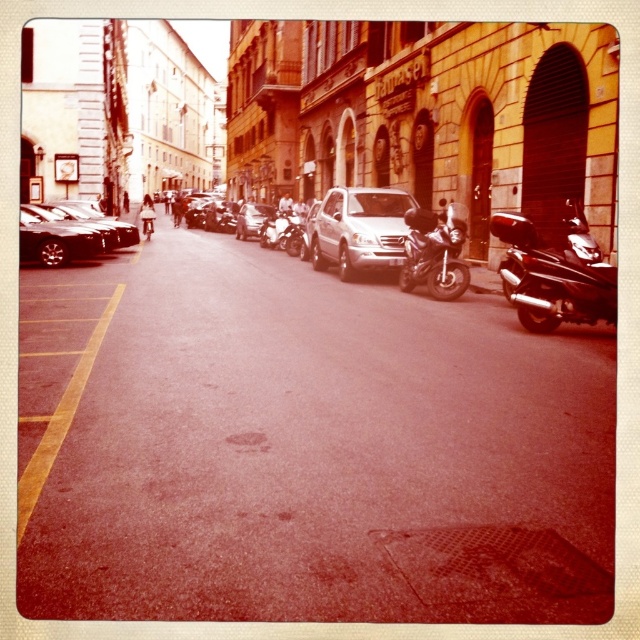
You are a delivery person trying to park your vehicle in this narrow street. You see the silver metallic van at center and the shiny chrome motorcycle at right. Which vehicle has more space available for parking next to it?

The silver metallic van at center is smaller than the shiny chrome motorcycle at right, so there is more space available next to the shiny chrome motorcycle at right for parking.

You are standing in the middle of a narrow urban street in a European city. There is a point at coordinates point (416, 232) that you need to reach. Considering the distance, can you walk to that point without any obstacles?

The distance between point (416, 232) and you is 43.90 feet, so you can walk to that point without any obstacles as the distance is manageable.

You are a delivery driver who needs to park your vehicle in this narrow street. You have a silver metallic van at center and a shiny chrome motorcycle at right. Which vehicle can you park closer to the buildings on the right side without exceeding the width of the available space?

The silver metallic van at center has a lesser width compared to the shiny chrome motorcycle at right, so it can be parked closer to the buildings on the right side without exceeding the available space.